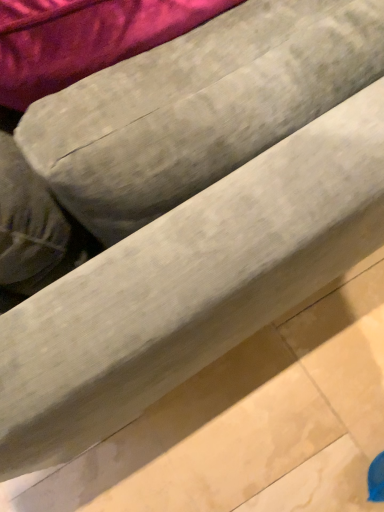
Question: Considering the positions of textured gray bean bag at center and beige marble tile at lower right in the image, is textured gray bean bag at center taller or shorter than beige marble tile at lower right?

Choices:
 (A) tall
 (B) short

Answer: (A)

Question: Relative to beige marble tile at lower right, is textured gray bean bag at center in front or behind?

Choices:
 (A) front
 (B) behind

Answer: (A)

Question: In the image, is textured gray bean bag at center on the left side or the right side of beige marble tile at lower right?

Choices:
 (A) left
 (B) right

Answer: (A)

Question: In terms of height, does beige marble tile at lower right look taller or shorter compared to textured gray bean bag at center?

Choices:
 (A) short
 (B) tall

Answer: (A)

Question: From the image's perspective, is beige marble tile at lower right above or below textured gray bean bag at center?

Choices:
 (A) above
 (B) below

Answer: (B)

Question: Is beige marble tile at lower right wider or thinner than textured gray bean bag at center?

Choices:
 (A) wide
 (B) thin

Answer: (A)

Question: Based on their sizes in the image, would you say beige marble tile at lower right is bigger or smaller than textured gray bean bag at center?

Choices:
 (A) big
 (B) small

Answer: (B)